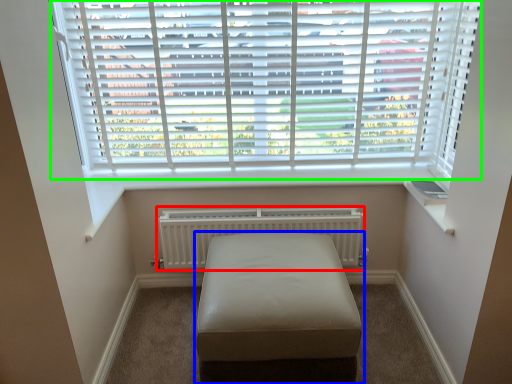
Question: Which object is the farthest from radiator (highlighted by a red box)? Choose among these: furniture (highlighted by a blue box) or window blind (highlighted by a green box).

Choices:
 (A) furniture
 (B) window blind

Answer: (B)